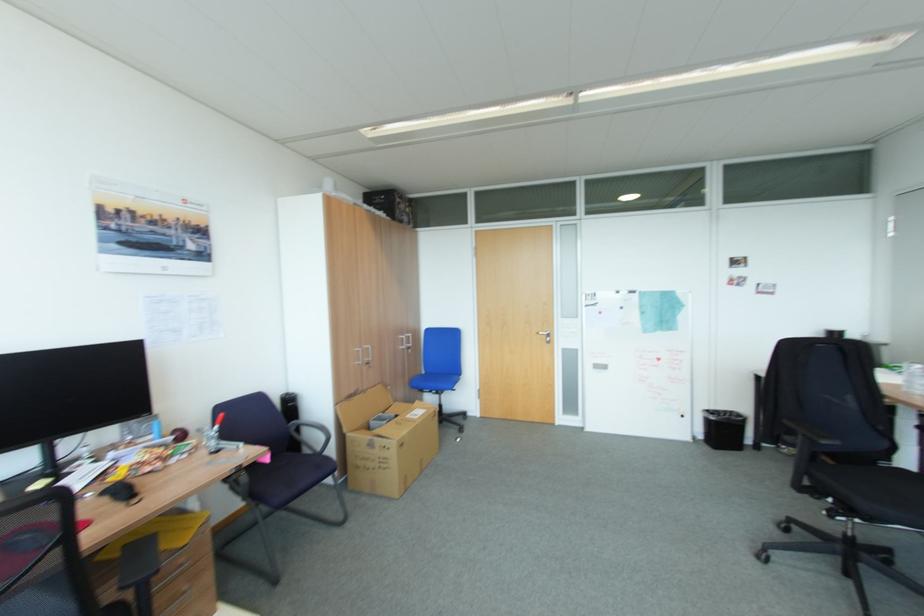
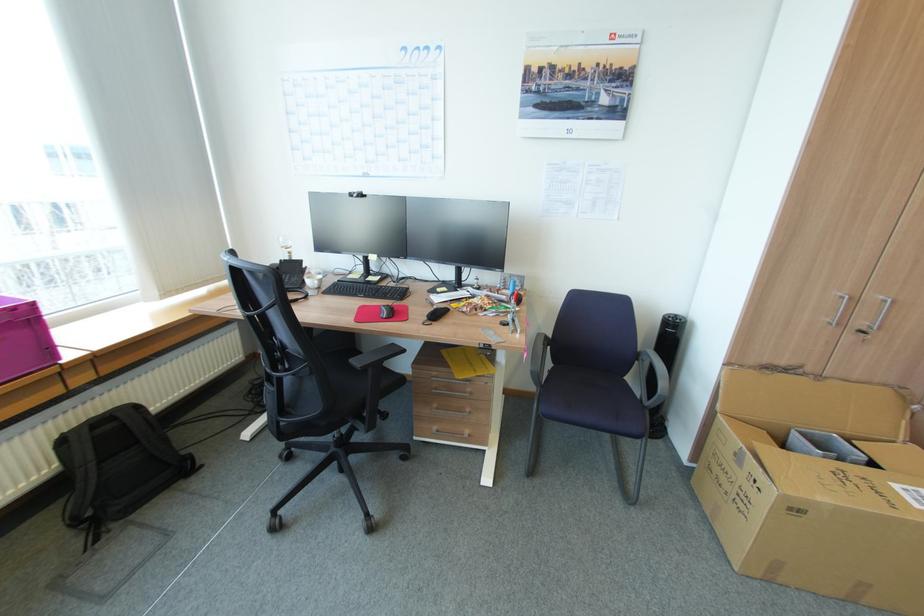
Locate, in the second image, the point that corresponds to point 407,445 in the first image.

(804, 511)